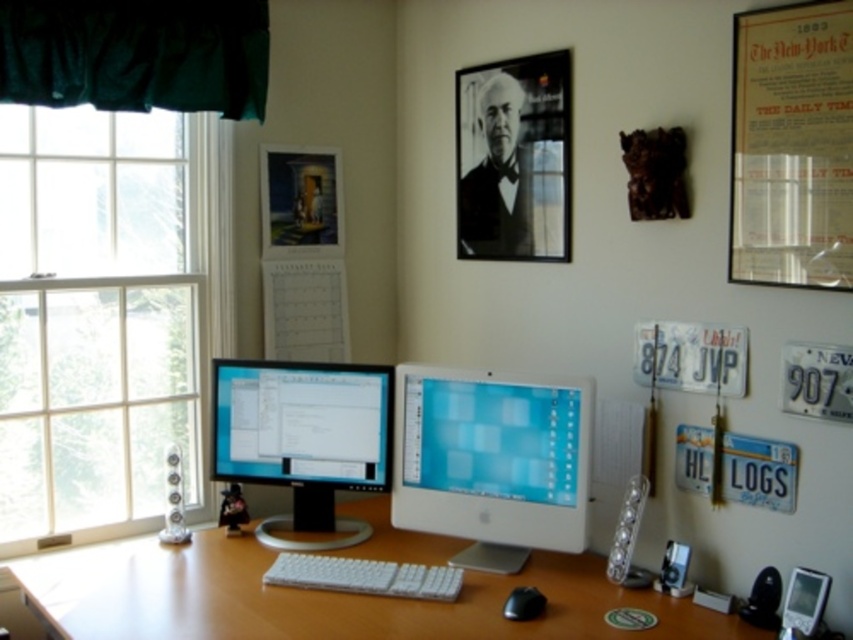
Is point (268, 205) farther from camera compared to point (334, 312)?

No, (268, 205) is in front of (334, 312).

Consider the image. Does matte wooden picture frame at upper center appear on the right side of white paper calendar at center?

Incorrect, matte wooden picture frame at upper center is not on the right side of white paper calendar at center.

You are a GUI agent. You are given a task and a screenshot of the screen. Output one action in this format:
    pyautogui.click(x=<x>, y=<y>)
    Task: Click on the matte wooden picture frame at upper center
    The image size is (853, 640).
    Given the screenshot: What is the action you would take?
    pyautogui.click(x=300, y=202)

Can you confirm if matte paper poster at upper right is positioned to the left of white paper calendar at center?

No, matte paper poster at upper right is not to the left of white paper calendar at center.

Who is positioned more to the right, matte paper poster at upper right or white paper calendar at center?

From the viewer's perspective, matte paper poster at upper right appears more on the right side.

Which is behind, point (755, 76) or point (294, 266)?

The point (294, 266) is more distant.

The height and width of the screenshot is (640, 853). I want to click on matte paper poster at upper right, so [x=791, y=147].

Between point (479, 477) and point (752, 120), which one is positioned in front?

Positioned in front is point (752, 120).

Where is `white glossy monitor at center`? Image resolution: width=853 pixels, height=640 pixels. white glossy monitor at center is located at coordinates (491, 461).

Is point (488, 564) closer to camera compared to point (831, 148)?

No, (488, 564) is further to viewer.

Locate an element on the screen. white glossy monitor at center is located at coordinates [x=491, y=461].